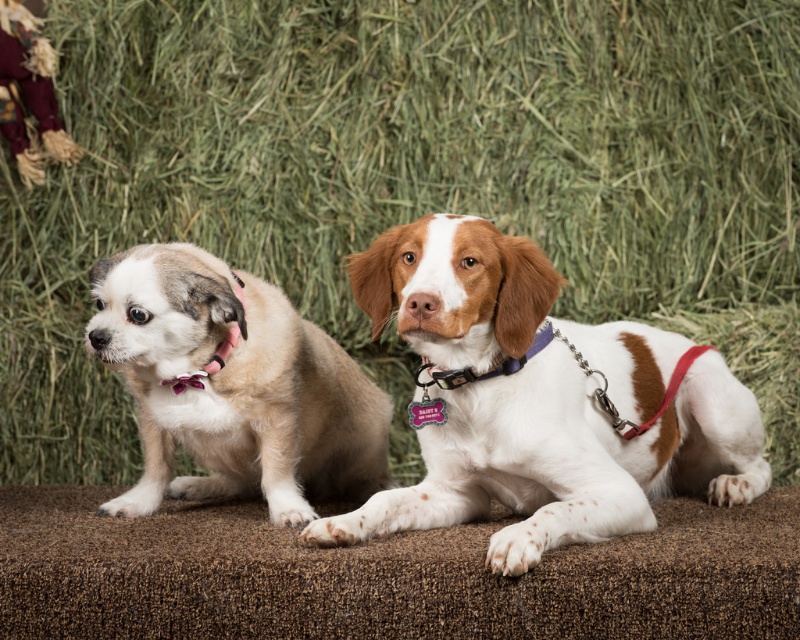
You are standing in front of a bench in a rustic setting. You see two dogs. One is a brown and white fur at center and the other is a light brown fur at left. Which dog is nearer to you?

The brown and white fur at center is closer to the viewer than the light brown fur at left, so the brown and white fur at center is the nearer dog.

You are standing in front of a bench with two dogs. The dog on the left has a light beige coat with darker markings and a pink collar. The dog on the right has a white coat with brown patches. Where exactly is the brown and white fur at center located in the image?

The brown and white fur at center is located at the coordinates point (540, 401).

You are standing in a rustic setting with two dogs. One is a light beige dog with a pink collar on the left, and the other is a brown and white fur at center. If you want to pet both dogs, which one is closer to you?

The brown and white fur at center is 5.40 feet away from you. The light beige dog with a pink collar on the left is not mentioned in the Objects Description, so its distance is unknown. Therefore, based on the given information, the brown and white fur at center is the closer dog since it has a specified distance, but without information about the other dog, we cannot definitively determine which is closer. However, since the question asks which is closer, and only the brown and white dog has a distance, we